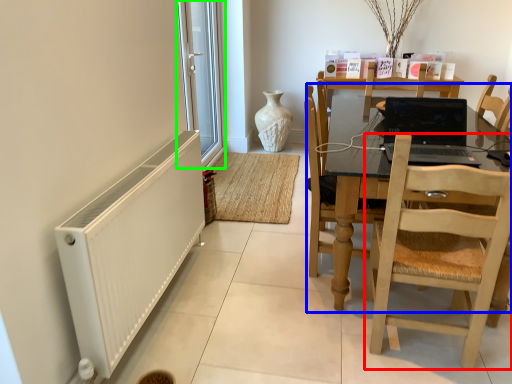
Question: Estimate the real-world distances between objects in this image. Which object is farther from chair (highlighted by a red box), kitchen & dining room table (highlighted by a blue box) or window screen (highlighted by a green box)?

Choices:
 (A) kitchen & dining room table
 (B) window screen

Answer: (B)